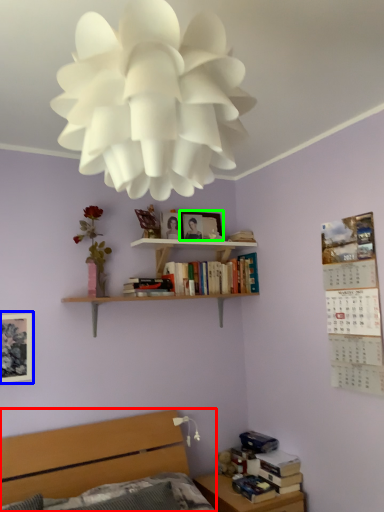
Question: Estimate the real-world distances between objects in this image. Which object is farther from bed (highlighted by a red box), picture frame (highlighted by a blue box) or picture frame (highlighted by a green box)?

Choices:
 (A) picture frame
 (B) picture frame

Answer: (B)